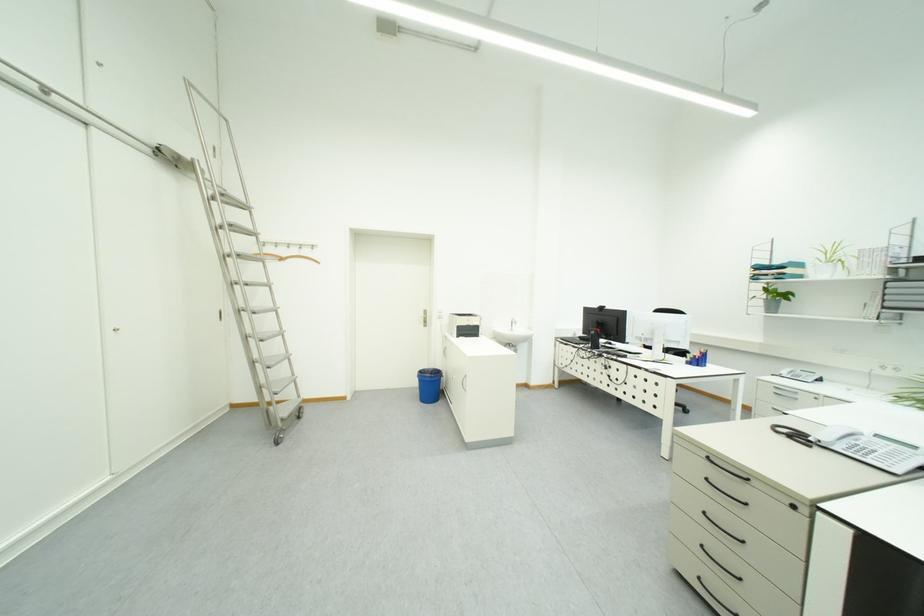
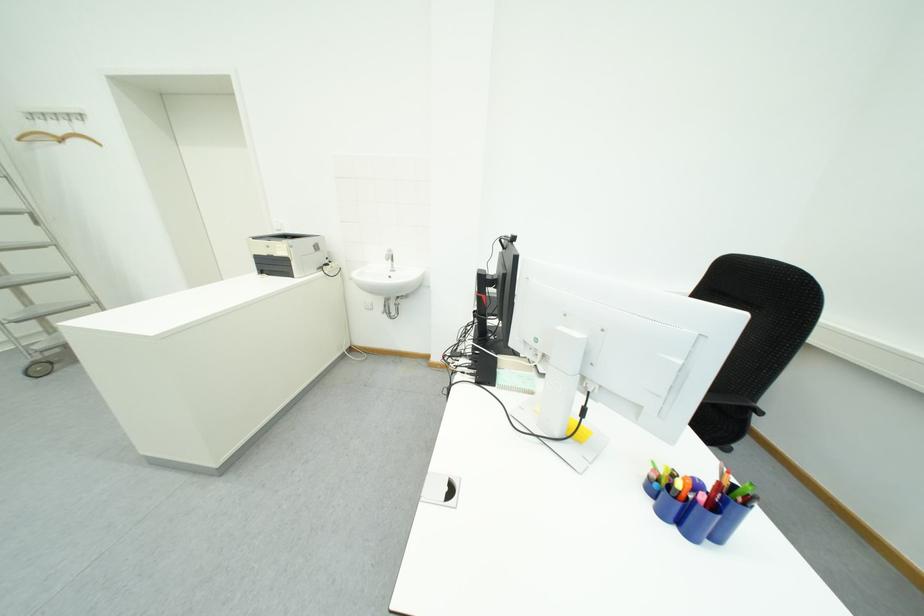
Based on the photo, the images are taken continuously from a first-person perspective. In which direction are you moving?

The movement direction of the cameraman is right, forward.